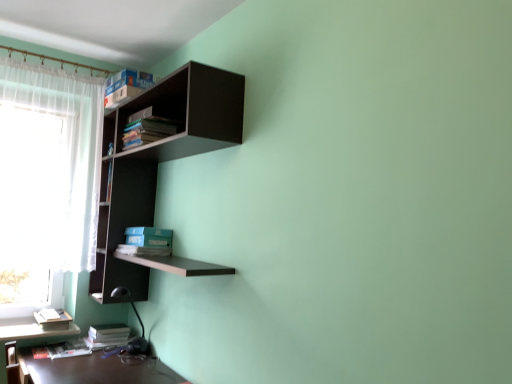
This screenshot has height=384, width=512. In order to click on free space above white paper book at lower left, which is the third book from bottom to top (from a real-world perspective) in this screenshot , I will do `click(52, 310)`.